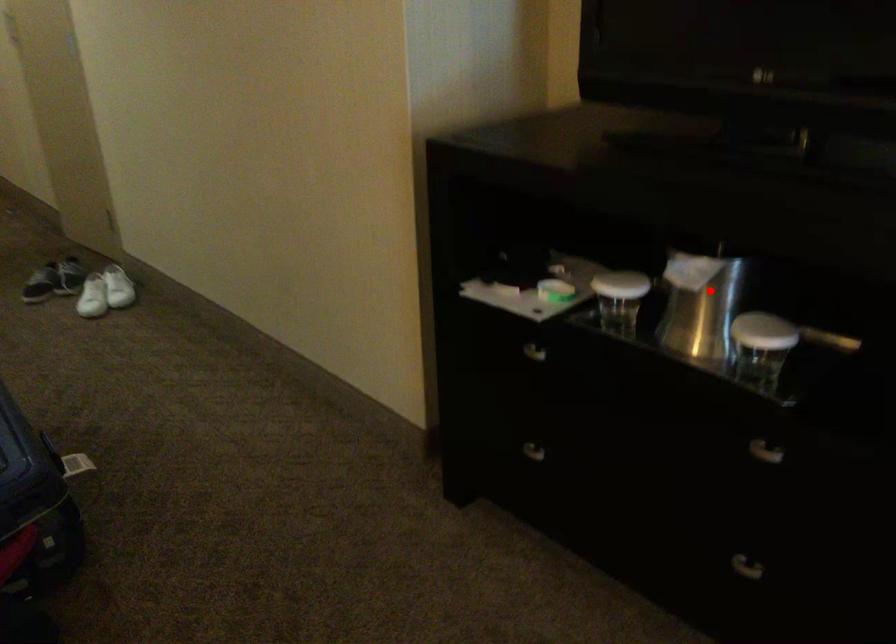
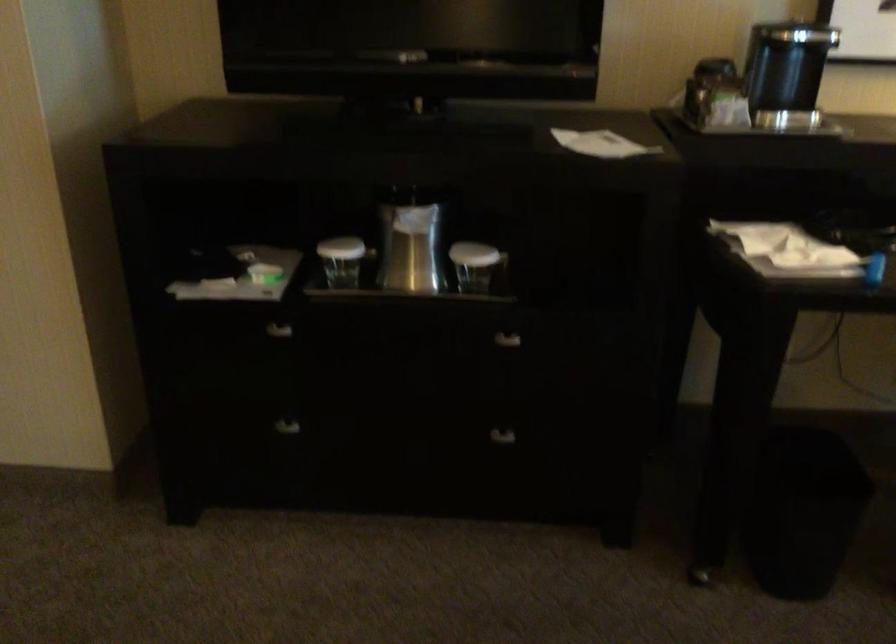
Question: I am providing you with two images of the same scene from different viewpoints. Given a red point in image1, look at the same physical point in image2. Is it:

Choices:
 (A) Closer to the viewpoint
 (B) Farther from the viewpoint

Answer: (B)